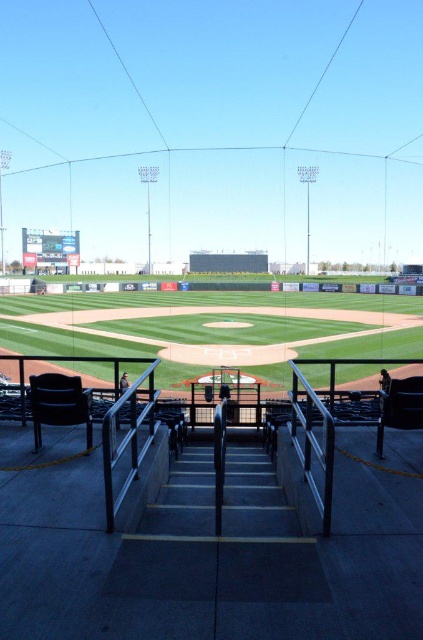
You are a spectator sitting in the stadium and want to walk down to the field. You see the green grass baseball field at center and the dark gray concrete stairs at center. Which direction should you walk to reach the stairs first?

You should walk to the right because the green grass baseball field at center is to the left of dark gray concrete stairs at center, meaning the stairs are on the right side relative to the field.

You are a groundskeeper who needs to mow the green grass baseball field at center and clean the dark gray concrete stairs at center. Which task should you complete first if you want to work on the wider area first?

The green grass baseball field at center is wider than the dark gray concrete stairs at center, so you should mow the green grass baseball field at center first.